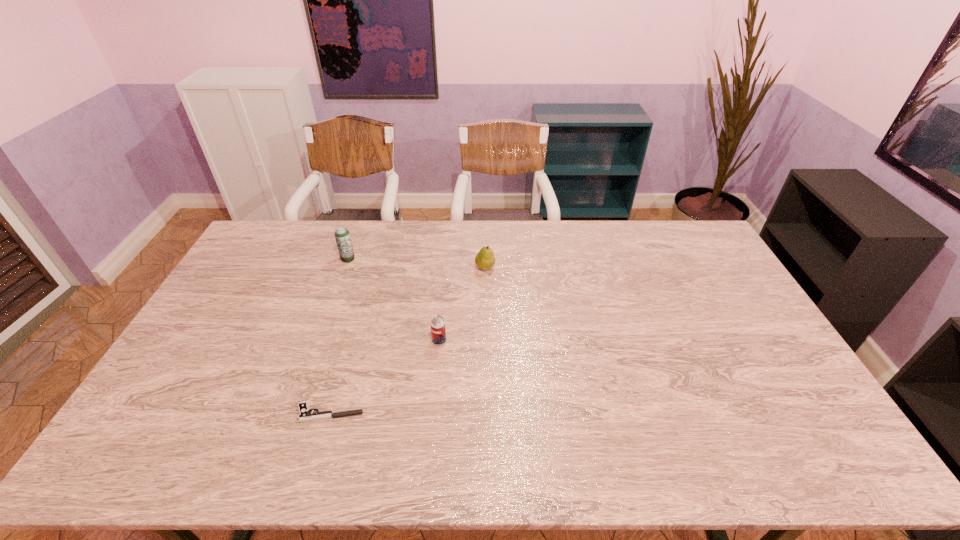
Find the location of a particular element. the farther beer can is located at coordinates (342, 235).

At what (x,y) coordinates should I click in order to perform the action: click on the taller beer can. Please return your answer as a coordinate pair (x, y). This screenshot has width=960, height=540. Looking at the image, I should click on click(x=342, y=235).

Find the location of a particular element. The width and height of the screenshot is (960, 540). the rightmost object is located at coordinates point(485,259).

Locate an element on the screen. the shorter beer can is located at coordinates (438, 329).

This screenshot has width=960, height=540. Identify the location of the nearer beer can. (438, 329).

Where is `the shortest object`? the shortest object is located at coordinates (305, 416).

Find the location of `the nearest object`. the nearest object is located at coordinates (305, 416).

Find the location of a particular element. free space located on the right of the taller beer can is located at coordinates (434, 259).

I want to click on vacant region located 0.330m on the left of the pear, so click(383, 267).

Find the location of `vacant space located on the back of the nearer beer can`. vacant space located on the back of the nearer beer can is located at coordinates (442, 319).